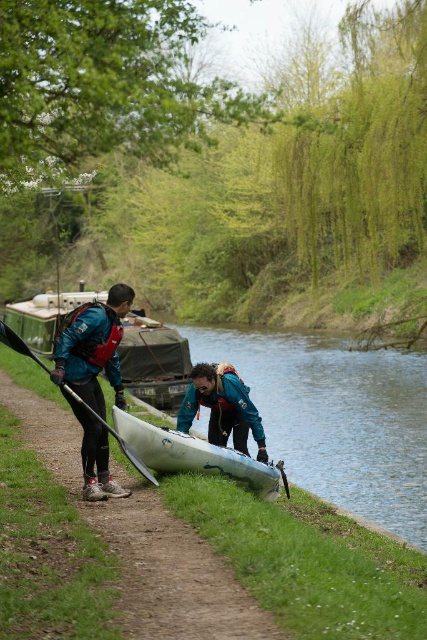
Question: Which of these objects is positioned farthest from the white plastic canoe at lower center?

Choices:
 (A) matte blue jacket at left
 (B) matte blue kayak at lower center
 (C) teal fabric jacket at lower center

Answer: (B)

Question: Does matte blue kayak at lower center have a lesser width compared to matte black paddle at left?

Choices:
 (A) yes
 (B) no

Answer: (B)

Question: Is matte blue kayak at lower center thinner than white plastic canoe at lower center?

Choices:
 (A) yes
 (B) no

Answer: (B)

Question: Which of the following is the closest to the observer?

Choices:
 (A) white plastic canoe at lower center
 (B) teal fabric jacket at lower center
 (C) matte black paddle at left
 (D) matte blue kayak at lower center

Answer: (D)

Question: Observing the image, what is the correct spatial positioning of white plastic canoe at lower center in reference to matte black paddle at left?

Choices:
 (A) left
 (B) right

Answer: (B)

Question: Which point appears closest to the camera in this image?

Choices:
 (A) (145, 445)
 (B) (259, 452)

Answer: (A)